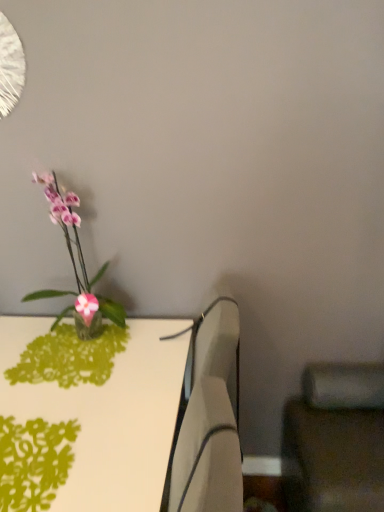
Measure the distance between green papercut at lower left and camera.

They are 83.90 centimeters apart.

Locate an element on the screen. The width and height of the screenshot is (384, 512). matte black swivel chair at lower right, which is counted as the second swivel chair, starting from the left is located at coordinates (335, 439).

Where is `white plastic swivel chair at center, which is the second swivel chair in right-to-left order`? white plastic swivel chair at center, which is the second swivel chair in right-to-left order is located at coordinates (209, 420).

Is white plastic swivel chair at center, which is the second swivel chair in right-to-left order, wider than pink glass vase at left?

No.

This screenshot has width=384, height=512. Find the location of `the 1st swivel chair to the right when counting from the pink glass vase at left`. the 1st swivel chair to the right when counting from the pink glass vase at left is located at coordinates 209,420.

Considering the relative sizes of white plastic swivel chair at center, the first swivel chair from the left, and pink glass vase at left in the image provided, is white plastic swivel chair at center, the first swivel chair from the left, shorter than pink glass vase at left?

No.

Does white plastic swivel chair at center, the first swivel chair from the left, turn towards pink glass vase at left?

No, white plastic swivel chair at center, the first swivel chair from the left, is not turned towards pink glass vase at left.

Is green papercut at lower left facing away from pink glass vase at left?

That's not correct — green papercut at lower left is not looking away from pink glass vase at left.

From a real-world perspective, who is located lower, green papercut at lower left or pink glass vase at left?

green papercut at lower left.

Is green papercut at lower left to the left of pink glass vase at left from the viewer's perspective?

Indeed, green papercut at lower left is positioned on the left side of pink glass vase at left.

From a real-world perspective, is pink glass vase at left physically located above or below green papercut at lower left?

Clearly, from a real-world perspective, pink glass vase at left is above green papercut at lower left.

Can green papercut at lower left be found inside pink glass vase at left?

No, green papercut at lower left is not a part of pink glass vase at left.

In the image, there is a pink glass vase at left. Identify the location of plant below it (from a real-world perspective). (34, 462).

Does white plastic swivel chair at center, which is the second swivel chair in right-to-left order, have a greater width compared to matte green table at left?

In fact, white plastic swivel chair at center, which is the second swivel chair in right-to-left order, might be narrower than matte green table at left.

Considering the sizes of objects white plastic swivel chair at center, the first swivel chair from the left, and matte green table at left in the image provided, who is taller, white plastic swivel chair at center, the first swivel chair from the left, or matte green table at left?

white plastic swivel chair at center, the first swivel chair from the left.

The height and width of the screenshot is (512, 384). I want to click on swivel chair lying above the matte green table at left (from the image's perspective), so click(x=209, y=420).

Are white plastic swivel chair at center, the first swivel chair from the left, and matte green table at left located far from each other?

No, there isn't a large distance between white plastic swivel chair at center, the first swivel chair from the left, and matte green table at left.

Relative to white plastic swivel chair at center, the first swivel chair from the left, is green papercut at lower left in front or behind?

green papercut at lower left is positioned closer to the viewer than white plastic swivel chair at center, the first swivel chair from the left.

Can you confirm if green papercut at lower left is shorter than white plastic swivel chair at center, the first swivel chair from the left?

Yes.

From the image's perspective, which is above, green papercut at lower left or white plastic swivel chair at center, the first swivel chair from the left?

white plastic swivel chair at center, the first swivel chair from the left, appears higher in the image.

How many degrees apart are the facing directions of green papercut at lower left and white plastic swivel chair at center, which is the second swivel chair in right-to-left order?

The angle between the facing direction of green papercut at lower left and the facing direction of white plastic swivel chair at center, which is the second swivel chair in right-to-left order, is 20.8 degrees.

In terms of height, does matte green table at left look taller or shorter compared to white plastic swivel chair at center, which is the second swivel chair in right-to-left order?

In the image, matte green table at left appears to be shorter than white plastic swivel chair at center, which is the second swivel chair in right-to-left order.

From the image's perspective, does matte green table at left appear lower than white plastic swivel chair at center, the first swivel chair from the left?

Correct, matte green table at left appears lower than white plastic swivel chair at center, the first swivel chair from the left, in the image.

Is the position of matte green table at left more distant than that of white plastic swivel chair at center, which is the second swivel chair in right-to-left order?

No, matte green table at left is closer to the viewer.

Looking at this image, which object is wider, matte green table at left or white plastic swivel chair at center, which is the second swivel chair in right-to-left order?

matte green table at left.

From the image's perspective, would you say matte black swivel chair at lower right, which appears as the first swivel chair when viewed from the right, is positioned over white plastic swivel chair at center, which is the second swivel chair in right-to-left order?

Incorrect, from the image's perspective, matte black swivel chair at lower right, which appears as the first swivel chair when viewed from the right, is lower than white plastic swivel chair at center, which is the second swivel chair in right-to-left order.

Considering the sizes of objects matte black swivel chair at lower right, which appears as the first swivel chair when viewed from the right, and white plastic swivel chair at center, the first swivel chair from the left, in the image provided, who is thinner, matte black swivel chair at lower right, which appears as the first swivel chair when viewed from the right, or white plastic swivel chair at center, the first swivel chair from the left,?

white plastic swivel chair at center, the first swivel chair from the left, is thinner.

From a real-world perspective, between matte black swivel chair at lower right, which appears as the first swivel chair when viewed from the right, and white plastic swivel chair at center, which is the second swivel chair in right-to-left order, who is vertically higher?

From a 3D spatial view, white plastic swivel chair at center, which is the second swivel chair in right-to-left order, is above.

Is matte black swivel chair at lower right, which is counted as the second swivel chair, starting from the left, not near white plastic swivel chair at center, the first swivel chair from the left?

No.

This screenshot has height=512, width=384. What are the coordinates of `houseplant that appears in front of the white plastic swivel chair at center, which is the second swivel chair in right-to-left order` in the screenshot? It's located at (76, 267).

Where is `houseplant behind the green papercut at lower left`? This screenshot has width=384, height=512. houseplant behind the green papercut at lower left is located at coordinates (76, 267).

From the image, which object appears to be nearer to matte green table at left, matte black swivel chair at lower right, which is counted as the second swivel chair, starting from the left, or white plastic swivel chair at center, the first swivel chair from the left?

Based on the image, white plastic swivel chair at center, the first swivel chair from the left, appears to be nearer to matte green table at left.

Which object lies nearer to the anchor point green papercut at lower left, matte black swivel chair at lower right, which appears as the first swivel chair when viewed from the right, or white plastic swivel chair at center, which is the second swivel chair in right-to-left order?

Among the two, white plastic swivel chair at center, which is the second swivel chair in right-to-left order, is located nearer to green papercut at lower left.

Based on their spatial positions, is pink glass vase at left or white plastic swivel chair at center, the first swivel chair from the left, closer to green papercut at lower left?

white plastic swivel chair at center, the first swivel chair from the left, is closer to green papercut at lower left.

Looking at the image, which one is located further to green papercut at lower left, matte green table at left or pink glass vase at left?

Based on the image, pink glass vase at left appears to be further to green papercut at lower left.

From the image, which object appears to be farther from pink glass vase at left, white plastic swivel chair at center, the first swivel chair from the left, or matte black swivel chair at lower right, which appears as the first swivel chair when viewed from the right?

Among the two, matte black swivel chair at lower right, which appears as the first swivel chair when viewed from the right, is located further to pink glass vase at left.

Estimate the real-world distances between objects in this image. Which object is closer to matte green table at left, white plastic swivel chair at center, which is the second swivel chair in right-to-left order, or pink glass vase at left?

white plastic swivel chair at center, which is the second swivel chair in right-to-left order, lies closer to matte green table at left than the other object.

Which object lies nearer to the anchor point white plastic swivel chair at center, the first swivel chair from the left, pink glass vase at left or matte green table at left?

matte green table at left is closer to white plastic swivel chair at center, the first swivel chair from the left.

From the picture: When comparing their distances from matte green table at left, does matte black swivel chair at lower right, which is counted as the second swivel chair, starting from the left, or green papercut at lower left seem closer?

green papercut at lower left is positioned closer to the anchor matte green table at left.

The image size is (384, 512). I want to click on table between green papercut at lower left and matte black swivel chair at lower right, which is counted as the second swivel chair, starting from the left, in the horizontal direction, so click(96, 418).

This screenshot has height=512, width=384. I want to click on table between green papercut at lower left and white plastic swivel chair at center, the first swivel chair from the left, along the z-axis, so click(x=96, y=418).

The width and height of the screenshot is (384, 512). What are the coordinates of `swivel chair located between pink glass vase at left and matte black swivel chair at lower right, which is counted as the second swivel chair, starting from the left, in the left-right direction` in the screenshot? It's located at (209, 420).

Image resolution: width=384 pixels, height=512 pixels. Identify the location of plant that lies between pink glass vase at left and matte green table at left from top to bottom. (34, 462).